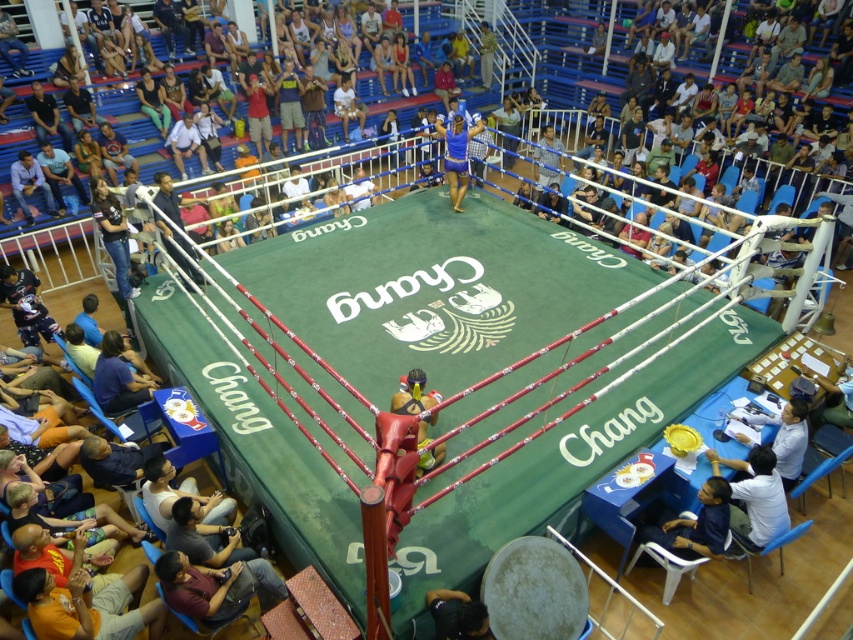
You are a photographer standing at the lower right of the arena. You want to take a photo of the boxing match. The camera you are holding is 4.80 meters away from the light blue shirt at lower right. Is the camera close enough to capture the boxing match clearly?

The camera is 4.80 meters away from the light blue shirt at lower right. Since the boxing match is taking place in the ring which is in the center of the arena, the distance between the camera and the ring would depend on the total size of the arena. However, 4.80 meters is a reasonable distance for capturing clear photos of the match, especially with a standard zoom lens. Therefore, the camera is close enough to capture the boxing match clearly.

You are a photographer in the boxing arena. You need to capture a photo that includes both the maroon fabric shirt at lower left and the dark blue shirt at lower right. Which shirt should you position closer to the foreground to ensure both are in focus?

To ensure both the maroon fabric shirt at lower left and the dark blue shirt at lower right are in focus, position the maroon fabric shirt at lower left closer to the foreground since it is shorter than the dark blue shirt at lower right, allowing the depth of field to cover both effectively.